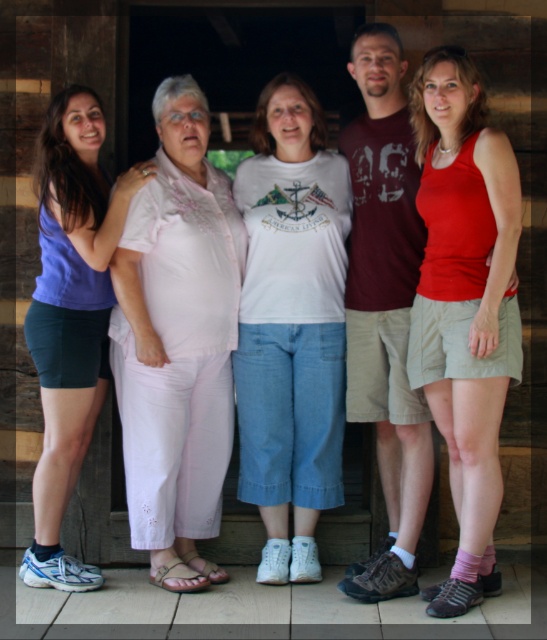
Question: Which of the following is the farthest from the observer?

Choices:
 (A) (278, 429)
 (B) (485, 500)
 (C) (80, 365)

Answer: (A)

Question: Is white cotton t-shirt at center thinner than red matte tank top at center?

Choices:
 (A) yes
 (B) no

Answer: (B)

Question: Which of the following is the farthest from the observer?

Choices:
 (A) (78, 182)
 (B) (319, 140)

Answer: (B)

Question: Considering the relative positions of white cotton t-shirt at center and red matte tank top at center in the image provided, where is white cotton t-shirt at center located with respect to red matte tank top at center?

Choices:
 (A) left
 (B) right

Answer: (A)

Question: Can you confirm if white cotton t-shirt at center is smaller than matte purple tank top at left?

Choices:
 (A) yes
 (B) no

Answer: (B)

Question: Among these objects, which one is farthest from the camera?

Choices:
 (A) matte purple tank top at left
 (B) white cotton t-shirt at center
 (C) red matte tank top at center

Answer: (B)